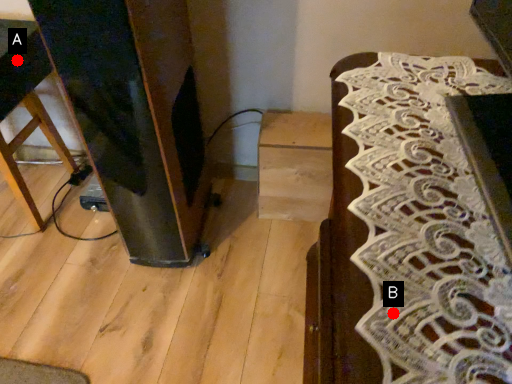
Question: Two points are circled on the image, labeled by A and B beside each circle. Which of the following is the closest to the observer?

Choices:
 (A) A is closer
 (B) B is closer

Answer: (B)